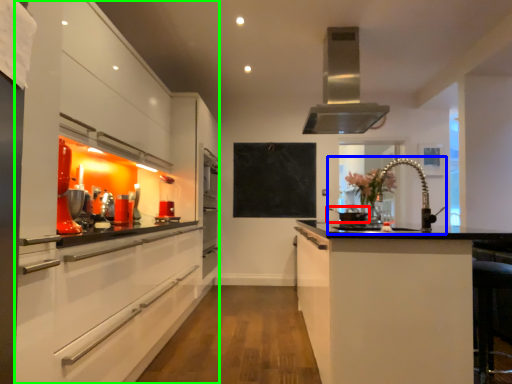
Question: Estimate the real-world distances between objects in this image. Which object is farther from appliance (highlighted by a red box), sink (highlighted by a blue box) or cabinetry (highlighted by a green box)?

Choices:
 (A) sink
 (B) cabinetry

Answer: (B)